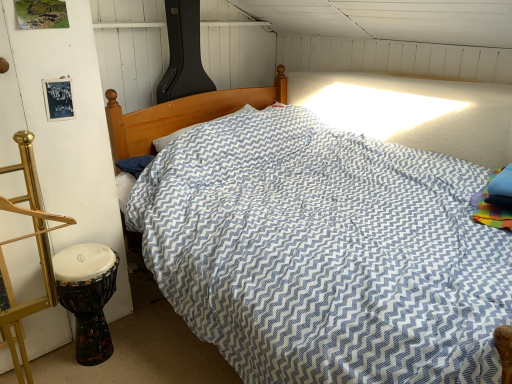
You are a GUI agent. You are given a task and a screenshot of the screen. Output one action in this format:
    pyautogui.click(x=<x>, y=<y>)
    Task: Click on the free space above decorative painted drum at left (from a real-world perspective)
    The image size is (512, 384).
    Given the screenshot: What is the action you would take?
    pyautogui.click(x=79, y=253)